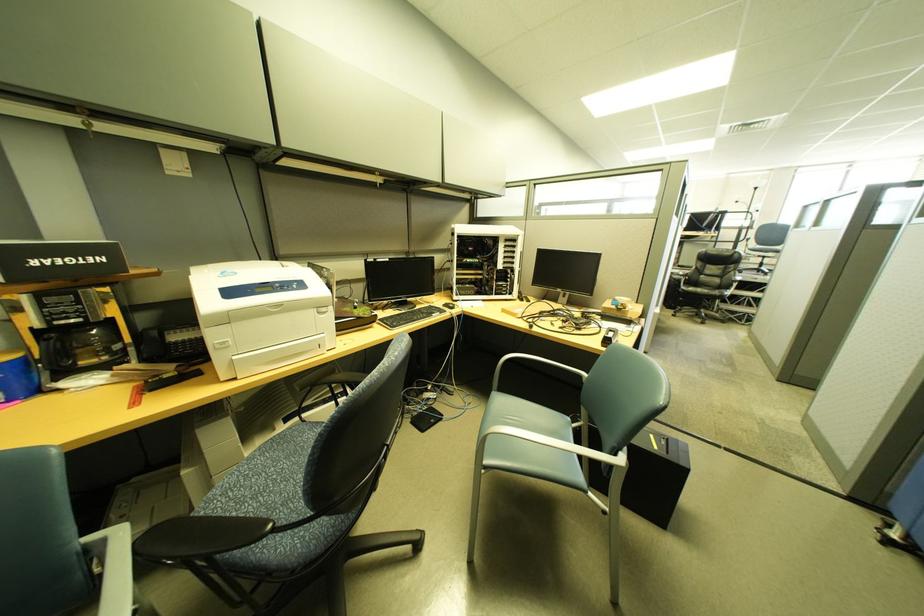
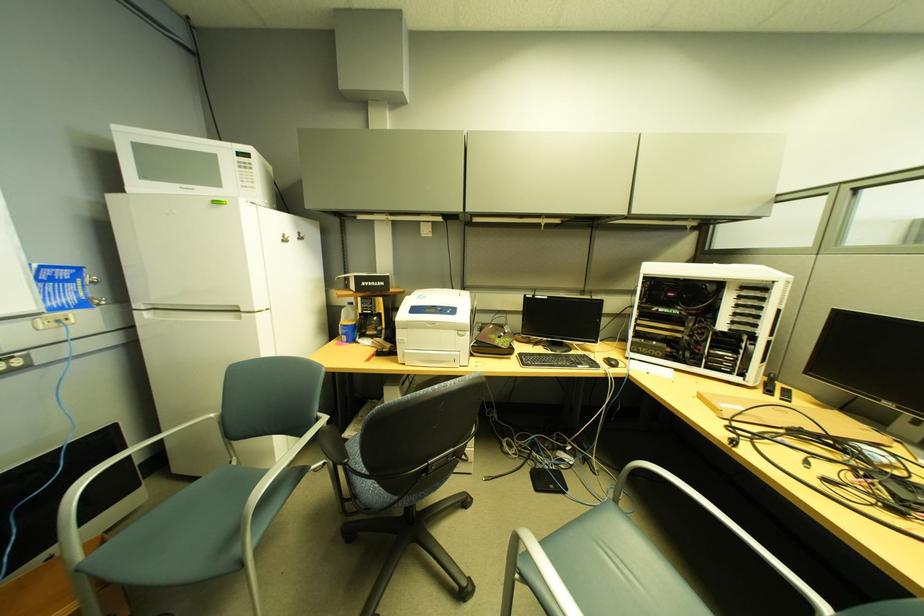
Where in the second image is the point corresponding to (281,529) from the first image?

(357, 464)